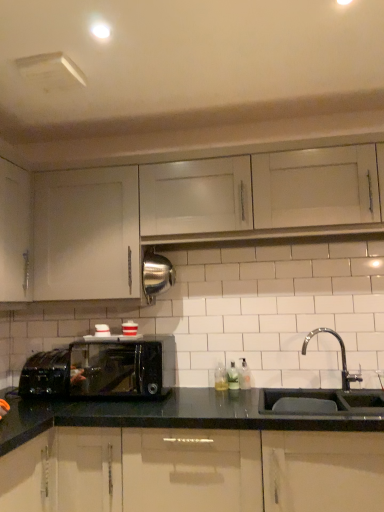
Question: Would you say white matte cabinet at upper center, the third cabinetry ordered from the bottom, is part of clear glass soap dispenser at sink right, which is counted as the first bottle, starting from the right,'s contents?

Choices:
 (A) yes
 (B) no

Answer: (B)

Question: Is clear glass soap dispenser at sink right, which is counted as the third bottle, starting from the left, behind white matte cabinet at upper center, arranged as the 1th cabinetry when viewed from the top?

Choices:
 (A) no
 (B) yes

Answer: (B)

Question: Can you confirm if clear glass soap dispenser at sink right, which is counted as the third bottle, starting from the left, is bigger than white matte cabinet at upper center, arranged as the 1th cabinetry when viewed from the top?

Choices:
 (A) yes
 (B) no

Answer: (B)

Question: Is clear glass soap dispenser at sink right, which is counted as the third bottle, starting from the left, smaller than white matte cabinet at upper center, the third cabinetry ordered from the bottom?

Choices:
 (A) no
 (B) yes

Answer: (B)

Question: Is clear glass soap dispenser at sink right, which is counted as the third bottle, starting from the left, at the left side of white matte cabinet at upper center, the third cabinetry ordered from the bottom?

Choices:
 (A) yes
 (B) no

Answer: (A)

Question: Relative to white matte cabinet at upper left, which appears as the 2th cabinetry when viewed from the top, is clear glass soap dispenser at sink right, which is counted as the third bottle, starting from the left, in front or behind?

Choices:
 (A) front
 (B) behind

Answer: (B)

Question: Considering the positions of point (243, 382) and point (137, 228), is point (243, 382) closer or farther from the camera than point (137, 228)?

Choices:
 (A) closer
 (B) farther

Answer: (B)

Question: Considering the positions of clear glass soap dispenser at sink right, which is counted as the third bottle, starting from the left, and white matte cabinet at upper left, which appears as the 2th cabinetry when viewed from the top, in the image, is clear glass soap dispenser at sink right, which is counted as the third bottle, starting from the left, bigger or smaller than white matte cabinet at upper left, which appears as the 2th cabinetry when viewed from the top,?

Choices:
 (A) small
 (B) big

Answer: (A)

Question: Visually, is clear glass soap dispenser at sink right, which is counted as the third bottle, starting from the left, positioned to the left or to the right of white matte cabinet at upper left, which appears as the 2th cabinetry when ordered from the bottom?

Choices:
 (A) right
 (B) left

Answer: (A)

Question: Is glossy black cabinets at lower center, positioned as the 3th cabinetry in top-to-bottom order, spatially inside black matte sink at lower right, or outside of it?

Choices:
 (A) outside
 (B) inside

Answer: (A)

Question: Considering the positions of point (72, 492) and point (306, 343), is point (72, 492) closer or farther from the camera than point (306, 343)?

Choices:
 (A) farther
 (B) closer

Answer: (B)

Question: From the image's perspective, is glossy black cabinets at lower center, arranged as the 1th cabinetry when ordered from the bottom, above or below black matte sink at lower right?

Choices:
 (A) below
 (B) above

Answer: (A)

Question: Is glossy black cabinets at lower center, positioned as the 3th cabinetry in top-to-bottom order, in front of or behind black matte sink at lower right in the image?

Choices:
 (A) behind
 (B) front

Answer: (B)

Question: From their relative heights in the image, would you say white matte cabinet at upper left, which appears as the 2th cabinetry when viewed from the top, is taller or shorter than translucent plastic soap at center, which is the 1th bottle in left-to-right order?

Choices:
 (A) short
 (B) tall

Answer: (B)

Question: Is white matte cabinet at upper left, which appears as the 2th cabinetry when viewed from the top, bigger or smaller than translucent plastic soap at center, which is the 1th bottle in left-to-right order?

Choices:
 (A) big
 (B) small

Answer: (A)